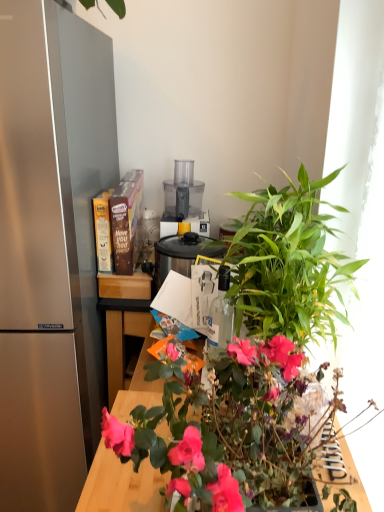
Question: Can you confirm if black plastic slow cooker at center, which is counted as the 3th appliance, starting from the top, is thinner than green leafy plant at center-right?

Choices:
 (A) no
 (B) yes

Answer: (B)

Question: Does black plastic slow cooker at center, the 1th appliance when ordered from bottom to top, have a smaller size compared to green leafy plant at center-right?

Choices:
 (A) no
 (B) yes

Answer: (B)

Question: Does black plastic slow cooker at center, which is counted as the 3th appliance, starting from the top, have a larger size compared to green leafy plant at center-right?

Choices:
 (A) no
 (B) yes

Answer: (A)

Question: Is green leafy plant at center-right inside black plastic slow cooker at center, the 1th appliance when ordered from bottom to top?

Choices:
 (A) no
 (B) yes

Answer: (A)

Question: Is black plastic slow cooker at center, the 1th appliance when ordered from bottom to top, far away from green leafy plant at center-right?

Choices:
 (A) yes
 (B) no

Answer: (B)

Question: From the image's perspective, is transparent glass bottle at center located above or below satin silver refrigerator at left?

Choices:
 (A) below
 (B) above

Answer: (A)

Question: From a real-world perspective, is transparent glass bottle at center positioned above or below satin silver refrigerator at left?

Choices:
 (A) above
 (B) below

Answer: (A)

Question: Is point (215, 343) closer or farther from the camera than point (11, 275)?

Choices:
 (A) farther
 (B) closer

Answer: (B)

Question: Considering the positions of transparent glass bottle at center and satin silver refrigerator at left in the image, is transparent glass bottle at center bigger or smaller than satin silver refrigerator at left?

Choices:
 (A) big
 (B) small

Answer: (B)

Question: From the image's perspective, is green leafy plant at center located above or below black plastic slow cooker at center, which is counted as the 3th appliance, starting from the top?

Choices:
 (A) above
 (B) below

Answer: (B)

Question: Considering the positions of green leafy plant at center and black plastic slow cooker at center, the 1th appliance when ordered from bottom to top, in the image, is green leafy plant at center taller or shorter than black plastic slow cooker at center, the 1th appliance when ordered from bottom to top,?

Choices:
 (A) tall
 (B) short

Answer: (A)

Question: Does point (248, 476) appear closer or farther from the camera than point (160, 279)?

Choices:
 (A) closer
 (B) farther

Answer: (A)

Question: Looking at their shapes, would you say green leafy plant at center is wider or thinner than black plastic slow cooker at center, the 1th appliance when ordered from bottom to top?

Choices:
 (A) thin
 (B) wide

Answer: (B)

Question: Considering their positions, is transparent plastic food processor at center, the third appliance when ordered from bottom to top, located in front of or behind green leafy plant at center?

Choices:
 (A) behind
 (B) front

Answer: (A)

Question: In terms of size, does transparent plastic food processor at center, marked as the 1th appliance in a top-to-bottom arrangement, appear bigger or smaller than green leafy plant at center?

Choices:
 (A) small
 (B) big

Answer: (A)